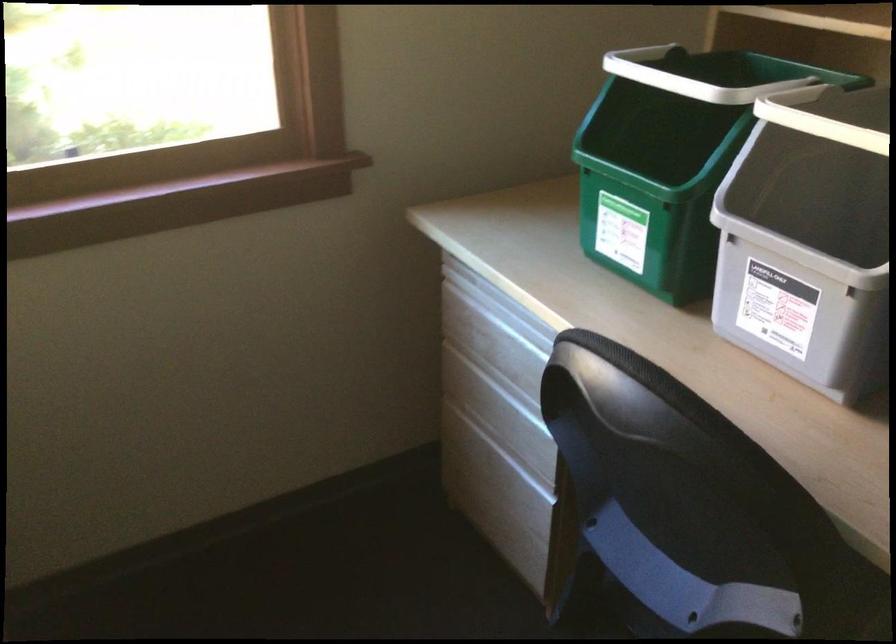
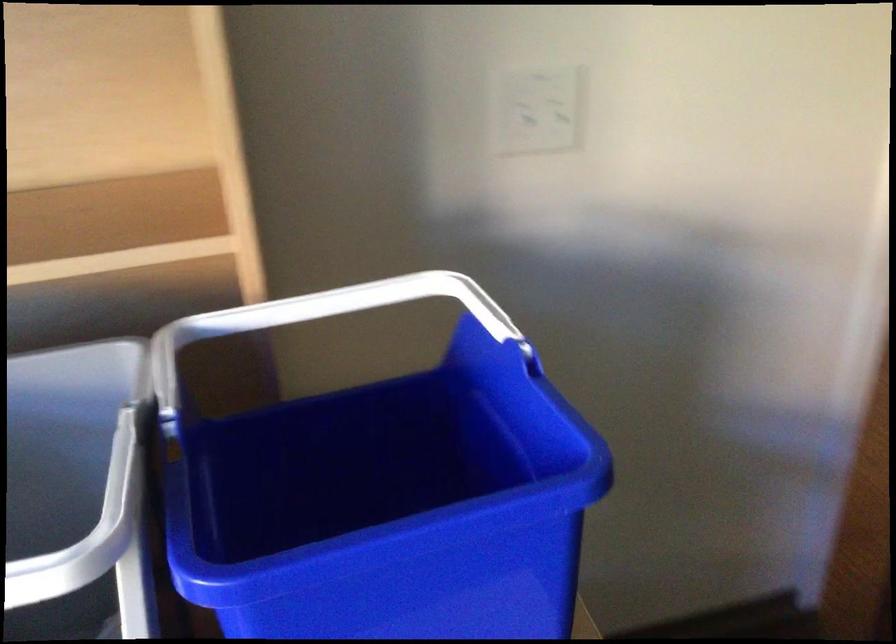
The first image is from the beginning of the video and the second image is from the end. How did the camera likely rotate when shooting the video?

The rotation direction of the camera is right-down.